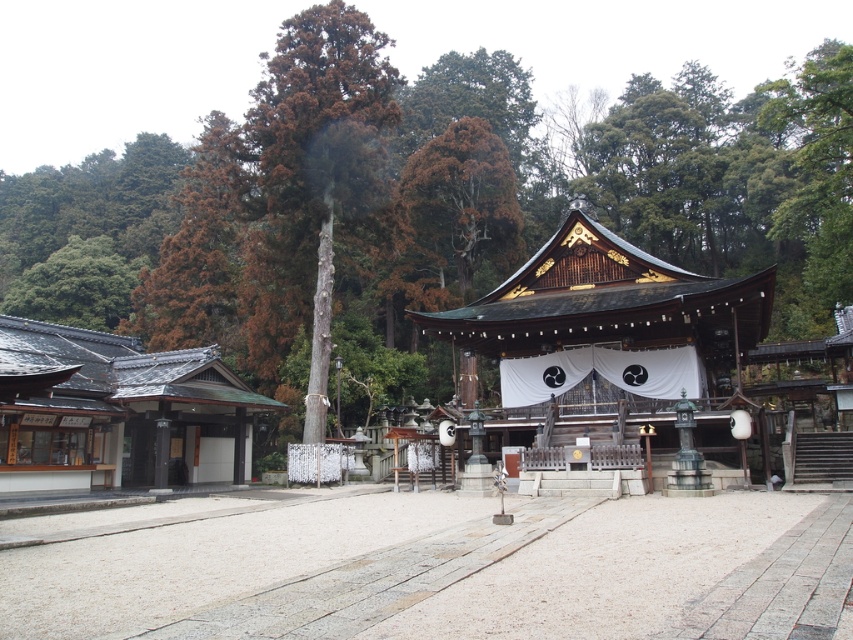
Question: Is brown wood tree at center positioned in front of wooden shrine at center?

Choices:
 (A) no
 (B) yes

Answer: (A)

Question: Does brown wood tree at center appear over wooden shrine at center?

Choices:
 (A) no
 (B) yes

Answer: (B)

Question: Which point is closer to the camera taking this photo?

Choices:
 (A) (289, 310)
 (B) (619, 273)

Answer: (B)

Question: Which object appears farthest from the camera in this image?

Choices:
 (A) brown wood tree at center
 (B) wooden shrine at center

Answer: (A)

Question: Which object appears farthest from the camera in this image?

Choices:
 (A) brown wood tree at center
 (B) wooden shrine at center

Answer: (A)

Question: Where is brown wood tree at center located in relation to wooden shrine at center in the image?

Choices:
 (A) above
 (B) below

Answer: (A)